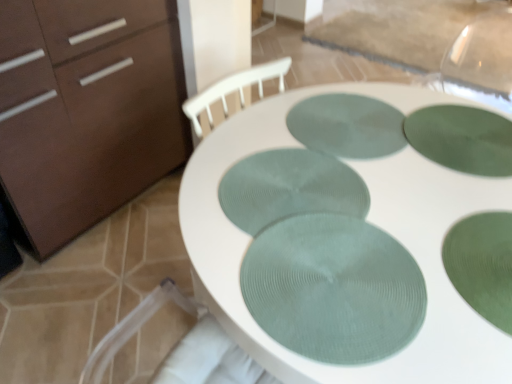
The image size is (512, 384). In order to click on matte brown cabinet at left in this screenshot , I will do `click(86, 110)`.

The image size is (512, 384). What are the coordinates of `green textured glass plate at center, the third glass plate when ordered from front to back` in the screenshot? It's located at (289, 188).

Based on the photo, how much space does green textured glass plate at upper right, placed as the 2th glass plate when sorted from back to front, occupy vertically?

It is 0.39 inches.

Describe the element at coordinates (462, 138) in the screenshot. The height and width of the screenshot is (384, 512). I see `green textured glass plate at upper right, placed as the 2th glass plate when sorted from back to front` at that location.

What do you see at coordinates (482, 265) in the screenshot? I see `green textured glass at center, acting as the second glass plate starting from the front` at bounding box center [482, 265].

You are a GUI agent. You are given a task and a screenshot of the screen. Output one action in this format:
    pyautogui.click(x=<x>, y=<y>)
    Task: Click on the matte brown cabinet at left
    
    Given the screenshot: What is the action you would take?
    pyautogui.click(x=86, y=110)

Is point (197, 228) behind point (338, 98)?

That is False.

Is white textured placemats at center taller than green textured placemat at center, which is the 1th glass plate in back-to-front order?

Yes.

At what (x,y) coordinates should I click in order to perform the action: click on the 5th glass plate above when counting from the white textured placemats at center (from the image's perspective). Please return your answer as a coordinate pair (x, y). Looking at the image, I should click on (347, 126).

Could you measure the distance between matte brown cabinet at left and green textured glass plate at upper right, placed as the 2th glass plate when sorted from back to front?

matte brown cabinet at left and green textured glass plate at upper right, placed as the 2th glass plate when sorted from back to front, are 1.19 meters apart.

Would you say green textured glass plate at upper right, placed as the 2th glass plate when sorted from back to front, is part of matte brown cabinet at left's contents?

No.

Find the location of a particular element. This screenshot has height=384, width=512. the 2nd glass plate above the matte brown cabinet at left (from a real-world perspective) is located at coordinates (462, 138).

How many degrees apart are the facing directions of matte brown cabinet at left and green textured glass plate at upper right, placed as the 2th glass plate when sorted from back to front?

72.8 degrees separate the facing orientations of matte brown cabinet at left and green textured glass plate at upper right, placed as the 2th glass plate when sorted from back to front.

Identify the location of the 3rd glass plate behind the green textured glass plate at center, the first glass plate viewed from the front. (462, 138).

From a real-world perspective, which is physically above, green textured glass plate at center, the first glass plate viewed from the front, or green textured glass plate at upper right, positioned as the 4th glass plate in front-to-back order?

green textured glass plate at center, the first glass plate viewed from the front.

Considering the positions of objects green textured glass plate at center, the first glass plate viewed from the front, and green textured glass plate at upper right, positioned as the 4th glass plate in front-to-back order, in the image provided, who is more to the left, green textured glass plate at center, the first glass plate viewed from the front, or green textured glass plate at upper right, positioned as the 4th glass plate in front-to-back order,?

From the viewer's perspective, green textured glass plate at center, the first glass plate viewed from the front, appears more on the left side.

Can you confirm if green textured glass plate at center, the first glass plate viewed from the front, is thinner than green textured glass plate at upper right, positioned as the 4th glass plate in front-to-back order?

Yes.

Which object is closer to the camera taking this photo, green textured placemat at center, which is the fifth glass plate in front-to-back order, or green textured glass at center, acting as the second glass plate starting from the front?

green textured glass at center, acting as the second glass plate starting from the front.

Could you tell me if green textured placemat at center, which is the fifth glass plate in front-to-back order, is turned towards green textured glass at center, acting as the second glass plate starting from the front?

No, green textured placemat at center, which is the fifth glass plate in front-to-back order, does not turn towards green textured glass at center, acting as the second glass plate starting from the front.

Based on their sizes in the image, would you say green textured placemat at center, which is the fifth glass plate in front-to-back order, is bigger or smaller than green textured glass at center, acting as the second glass plate starting from the front?

In the image, green textured placemat at center, which is the fifth glass plate in front-to-back order, appears to be larger than green textured glass at center, acting as the second glass plate starting from the front.

Do you think green textured placemat at center, which is the 1th glass plate in back-to-front order, is within green textured glass at center, positioned as the fourth glass plate in back-to-front order, or outside of it?

green textured placemat at center, which is the 1th glass plate in back-to-front order, cannot be found inside green textured glass at center, positioned as the fourth glass plate in back-to-front order.

Looking at the image, does green textured glass plate at center, the first glass plate viewed from the front, seem bigger or smaller compared to green textured glass at center, positioned as the fourth glass plate in back-to-front order?

Considering their sizes, green textured glass plate at center, the first glass plate viewed from the front, takes up more space than green textured glass at center, positioned as the fourth glass plate in back-to-front order.

Considering the sizes of objects green textured glass plate at center, the first glass plate viewed from the front, and green textured glass at center, positioned as the fourth glass plate in back-to-front order, in the image provided, who is wider, green textured glass plate at center, the first glass plate viewed from the front, or green textured glass at center, positioned as the fourth glass plate in back-to-front order,?

green textured glass at center, positioned as the fourth glass plate in back-to-front order, is wider.

Is green textured glass plate at center, the first glass plate viewed from the front, positioned with its back to green textured glass at center, positioned as the fourth glass plate in back-to-front order?

No, green textured glass plate at center, the first glass plate viewed from the front, is not facing away from green textured glass at center, positioned as the fourth glass plate in back-to-front order.

Is green textured glass plate at center, the first glass plate viewed from the front, in contact with green textured glass at center, acting as the second glass plate starting from the front?

They are not placed beside each other.

From the image's perspective, is green textured glass plate at center, the 3th glass plate viewed from the back, located above or below green textured placemat at center, which is the 1th glass plate in back-to-front order?

green textured glass plate at center, the 3th glass plate viewed from the back, is below green textured placemat at center, which is the 1th glass plate in back-to-front order.

Is green textured glass plate at center, the third glass plate when ordered from front to back, not inside green textured placemat at center, which is the 1th glass plate in back-to-front order?

Yes, green textured glass plate at center, the third glass plate when ordered from front to back, is not within green textured placemat at center, which is the 1th glass plate in back-to-front order.

From a real-world perspective, who is located lower, green textured glass plate at center, the third glass plate when ordered from front to back, or green textured placemat at center, which is the 1th glass plate in back-to-front order?

green textured placemat at center, which is the 1th glass plate in back-to-front order.

Visually, is green textured glass plate at center, the third glass plate when ordered from front to back, positioned to the left or to the right of green textured placemat at center, which is the 1th glass plate in back-to-front order?

green textured glass plate at center, the third glass plate when ordered from front to back, is to the left of green textured placemat at center, which is the 1th glass plate in back-to-front order.

Can you confirm if green textured glass at center, acting as the second glass plate starting from the front, is bigger than white textured placemats at center?

Actually, green textured glass at center, acting as the second glass plate starting from the front, might be smaller than white textured placemats at center.

Who is taller, green textured glass at center, positioned as the fourth glass plate in back-to-front order, or white textured placemats at center?

white textured placemats at center is taller.

Is green textured glass at center, acting as the second glass plate starting from the front, not near white textured placemats at center?

green textured glass at center, acting as the second glass plate starting from the front, is actually quite close to white textured placemats at center.

Considering the points (480, 259) and (422, 242), which point is in front, point (480, 259) or point (422, 242)?

Point (480, 259)

Locate an element on the screen. glass plate that is the 1st one when counting leftward from the white textured placemats at center is located at coordinates (347, 126).

At what (x,y) coordinates should I click in order to perform the action: click on the chest of drawers lying above the green textured glass plate at upper right, placed as the 2th glass plate when sorted from back to front (from the image's perspective). Please return your answer as a coordinate pair (x, y). Looking at the image, I should click on (86, 110).

When comparing their distances from green textured glass plate at center, the third glass plate when ordered from front to back, does matte brown cabinet at left or white textured placemats at center seem further?

matte brown cabinet at left.

When comparing their distances from green textured glass plate at center, the first glass plate viewed from the front, does green textured glass at center, positioned as the fourth glass plate in back-to-front order, or matte brown cabinet at left seem closer?

green textured glass at center, positioned as the fourth glass plate in back-to-front order.

Which object lies nearer to the anchor point matte brown cabinet at left, green textured glass plate at upper right, positioned as the 4th glass plate in front-to-back order, or green textured glass plate at center, the 3th glass plate viewed from the back?

green textured glass plate at center, the 3th glass plate viewed from the back.

Considering their positions, is green textured glass plate at upper right, placed as the 2th glass plate when sorted from back to front, positioned closer to white textured placemats at center than green textured glass at center, positioned as the fourth glass plate in back-to-front order?

Among the two, green textured glass plate at upper right, placed as the 2th glass plate when sorted from back to front, is located nearer to white textured placemats at center.

Considering their positions, is green textured placemat at center, which is the 1th glass plate in back-to-front order, positioned closer to green textured glass at center, acting as the second glass plate starting from the front, than white textured placemats at center?

Among the two, white textured placemats at center is located nearer to green textured glass at center, acting as the second glass plate starting from the front.

Estimate the real-world distances between objects in this image. Which object is closer to green textured glass plate at center, the third glass plate when ordered from front to back, green textured placemat at center, which is the fifth glass plate in front-to-back order, or green textured glass plate at center, the first glass plate viewed from the front?

The object closer to green textured glass plate at center, the third glass plate when ordered from front to back, is green textured glass plate at center, the first glass plate viewed from the front.

Based on their spatial positions, is green textured glass plate at center, the first glass plate viewed from the front, or green textured glass at center, positioned as the fourth glass plate in back-to-front order, further from white textured placemats at center?

The object further to white textured placemats at center is green textured glass at center, positioned as the fourth glass plate in back-to-front order.

When comparing their distances from green textured glass plate at upper right, placed as the 2th glass plate when sorted from back to front, does matte brown cabinet at left or white textured placemats at center seem further?

matte brown cabinet at left is positioned further to the anchor green textured glass plate at upper right, placed as the 2th glass plate when sorted from back to front.

The height and width of the screenshot is (384, 512). Identify the location of table between matte brown cabinet at left and green textured glass plate at upper right, placed as the 2th glass plate when sorted from back to front. (367, 219).

Locate an element on the screen. Image resolution: width=512 pixels, height=384 pixels. glass plate between matte brown cabinet at left and green textured glass plate at center, the first glass plate viewed from the front is located at coordinates (289, 188).

Locate an element on the screen. table located between green textured glass plate at center, the 3th glass plate viewed from the back, and green textured glass at center, acting as the second glass plate starting from the front, in the left-right direction is located at coordinates (367, 219).

Locate an element on the screen. This screenshot has height=384, width=512. table between matte brown cabinet at left and green textured glass at center, acting as the second glass plate starting from the front, in the horizontal direction is located at coordinates (367, 219).